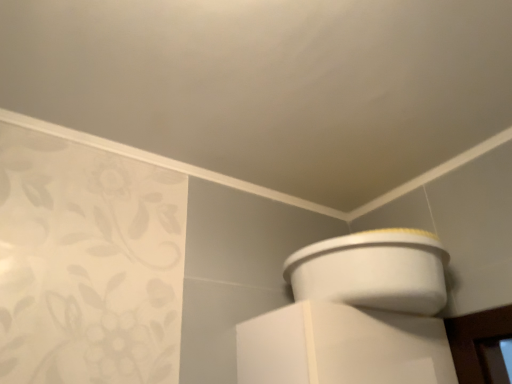
What do you see at coordinates (355, 315) in the screenshot? I see `white plastic toilet at upper right` at bounding box center [355, 315].

This screenshot has width=512, height=384. What are the coordinates of `white plastic toilet at upper right` in the screenshot? It's located at (355, 315).

I want to click on white plastic toilet at upper right, so click(355, 315).